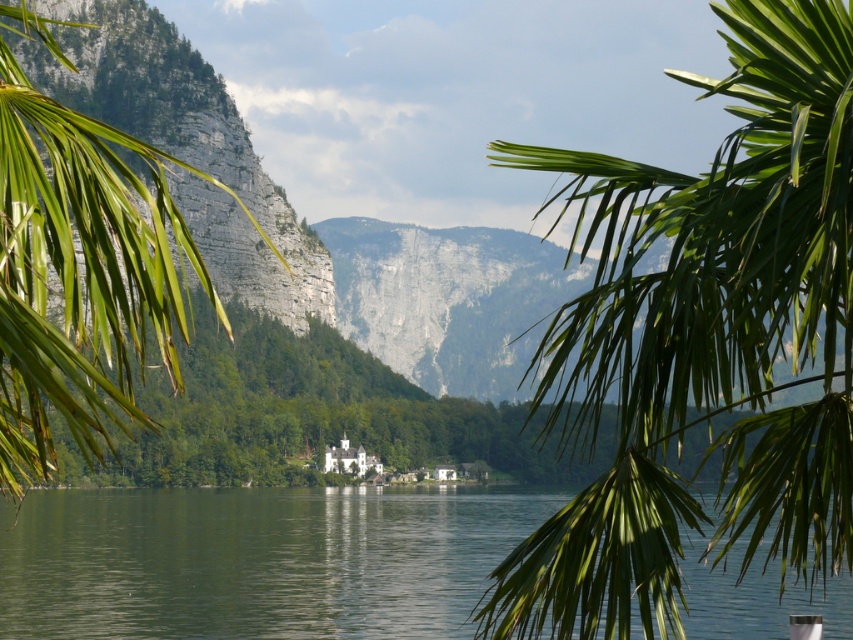
You are planning to install a floating dock on the green water at center. The dock requires a minimum of 100 feet of space between it and any nearby trees to avoid obstruction. Based on the scene, will the green leafy palm tree at upper right interfere with this requirement?

The green leafy palm tree at upper right and green water at center are 92.92 feet apart. Since this distance is less than the required 100 feet, the palm tree will interfere with the dock installation due to insufficient spacing.

You are a photographer trying to capture the reflection of the distant mountains in the green water at center. However, the green leafy palm tree at upper right is blocking your view. Can you adjust your position to avoid the palm tree while still seeing the mountains reflected in the water?

The green leafy palm tree at upper right is in front of the green water at center, so moving to the left or right might allow you to position yourself where the palm tree no longer blocks the view of the water and its reflection of the mountains.